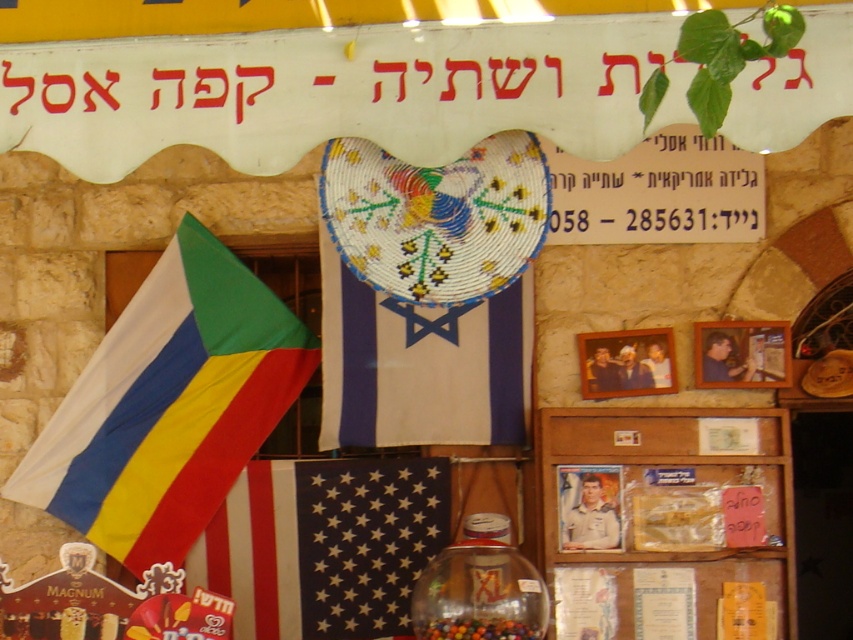
Question: Which of the following is the farthest from the observer?

Choices:
 (A) wooden at center
 (B) white fabric flag at center
 (C) shiny plastic beads at center

Answer: (B)

Question: Can you confirm if beaded fabric flag at center is positioned above white fabric flag at center?

Choices:
 (A) yes
 (B) no

Answer: (A)

Question: Which object is farther from the camera taking this photo?

Choices:
 (A) shiny plastic beads at center
 (B) multicolored fabric flag at left
 (C) wooden at center
 (D) white fabric flag at center

Answer: (B)

Question: Estimate the real-world distances between objects in this image. Which object is closer to the multicolored fabric flag at left?

Choices:
 (A) shiny plastic beads at center
 (B) beaded fabric flag at center
 (C) wooden at center
 (D) white fabric flag at center

Answer: (D)

Question: In this image, where is wooden at center located relative to shiny plastic beads at center?

Choices:
 (A) left
 (B) right

Answer: (B)

Question: Can you confirm if white fabric flag at center is positioned above shiny plastic beads at center?

Choices:
 (A) no
 (B) yes

Answer: (B)